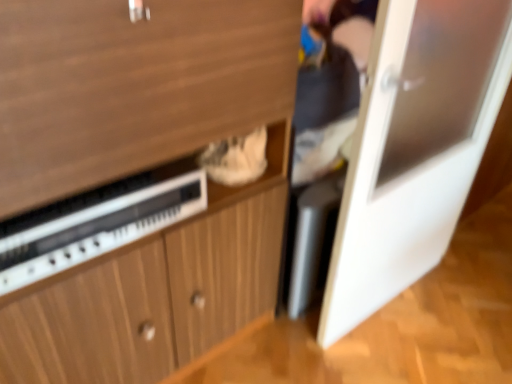
Question: From the image's perspective, is wooden cabinet at center on top of white glossy door at right?

Choices:
 (A) yes
 (B) no

Answer: (B)

Question: From a real-world perspective, is wooden cabinet at center below white glossy door at right?

Choices:
 (A) no
 (B) yes

Answer: (A)

Question: From the image's perspective, does wooden cabinet at center appear lower than white glossy door at right?

Choices:
 (A) no
 (B) yes

Answer: (B)

Question: Considering the relative positions of wooden cabinet at center and white glossy door at right in the image provided, is wooden cabinet at center to the left of white glossy door at right from the viewer's perspective?

Choices:
 (A) yes
 (B) no

Answer: (A)

Question: Does wooden cabinet at center have a smaller size compared to white glossy door at right?

Choices:
 (A) no
 (B) yes

Answer: (A)

Question: From the image's perspective, is white plastic radio at lower left located above or below white glossy door at right?

Choices:
 (A) below
 (B) above

Answer: (A)

Question: Considering the positions of white plastic radio at lower left and white glossy door at right in the image, is white plastic radio at lower left wider or thinner than white glossy door at right?

Choices:
 (A) wide
 (B) thin

Answer: (A)

Question: In terms of size, does white plastic radio at lower left appear bigger or smaller than white glossy door at right?

Choices:
 (A) big
 (B) small

Answer: (B)

Question: Is point (55, 269) closer or farther from the camera than point (398, 203)?

Choices:
 (A) farther
 (B) closer

Answer: (B)

Question: In the image, is white plastic radio at lower left on the left side or the right side of wooden cabinet at center?

Choices:
 (A) right
 (B) left

Answer: (B)

Question: From their relative heights in the image, would you say white plastic radio at lower left is taller or shorter than wooden cabinet at center?

Choices:
 (A) short
 (B) tall

Answer: (A)

Question: Is white plastic radio at lower left situated inside wooden cabinet at center or outside?

Choices:
 (A) outside
 (B) inside

Answer: (B)

Question: Is white plastic radio at lower left wider or thinner than wooden cabinet at center?

Choices:
 (A) wide
 (B) thin

Answer: (B)

Question: Choose the correct answer: Is white glossy door at right inside wooden cabinet at center or outside it?

Choices:
 (A) outside
 (B) inside

Answer: (A)

Question: In the image, is white glossy door at right positioned in front of or behind wooden cabinet at center?

Choices:
 (A) front
 (B) behind

Answer: (B)